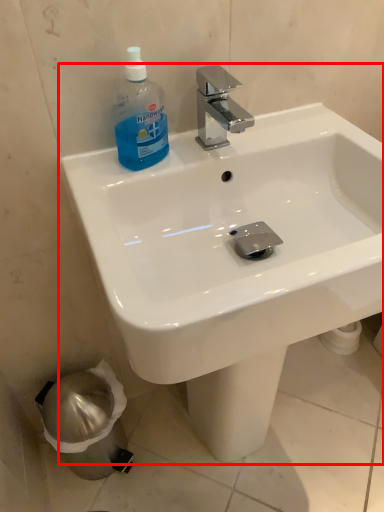
Question: From the image's perspective, considering the relative positions of sink (annotated by the red box) and cleaning product in the image provided, where is sink (annotated by the red box) located with respect to the staircase?

Choices:
 (A) below
 (B) above

Answer: (A)